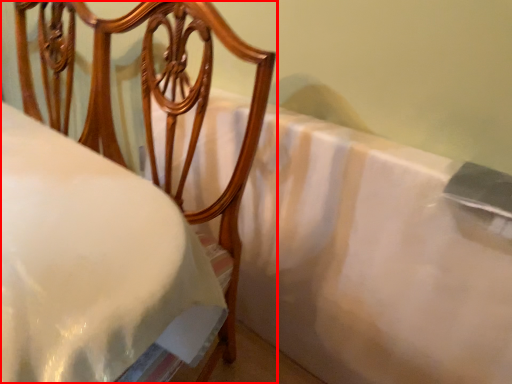
Question: Considering the relative positions of furniture (annotated by the red box) and sheet in the image provided, where is furniture (annotated by the red box) located with respect to the staircase?

Choices:
 (A) left
 (B) right

Answer: (A)